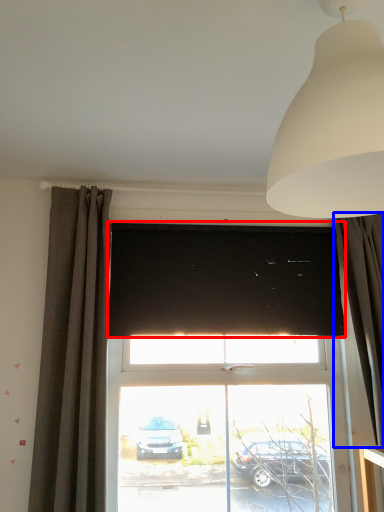
Question: Which point is closer to the camera, window screen (highlighted by a red box) or curtain (highlighted by a blue box)?

Choices:
 (A) window screen
 (B) curtain

Answer: (B)